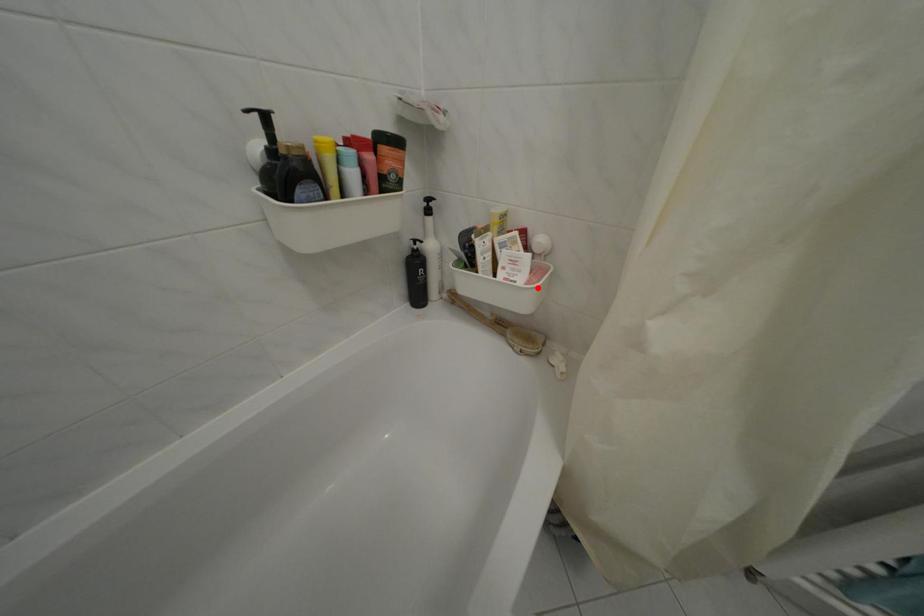
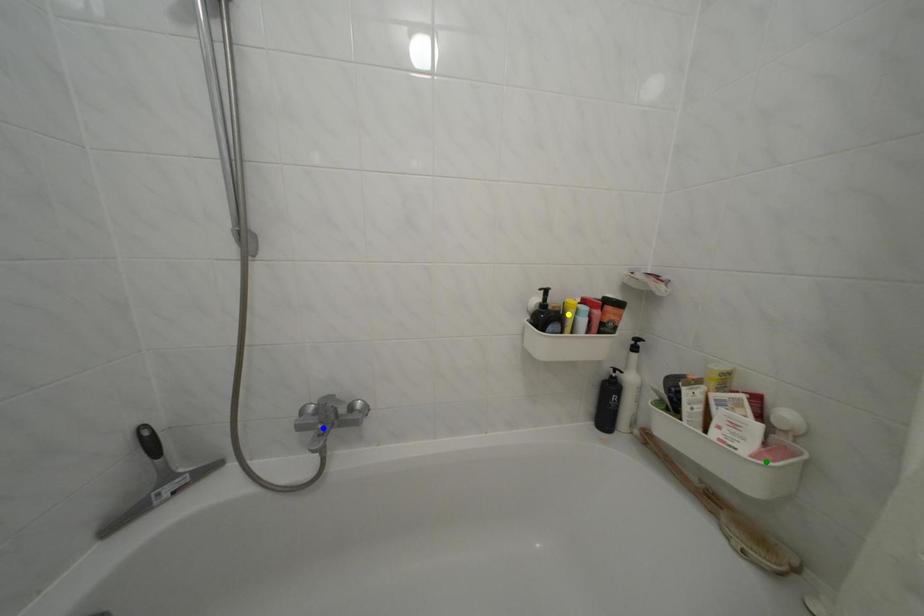
Question: I am providing you with two images of the same scene from different viewpoints. A red point is marked on the first image. You are given multiple points on the second image. Which mark in image 2 goes with the point in image 1?

Choices:
 (A) blue point
 (B) yellow point
 (C) green point

Answer: (C)